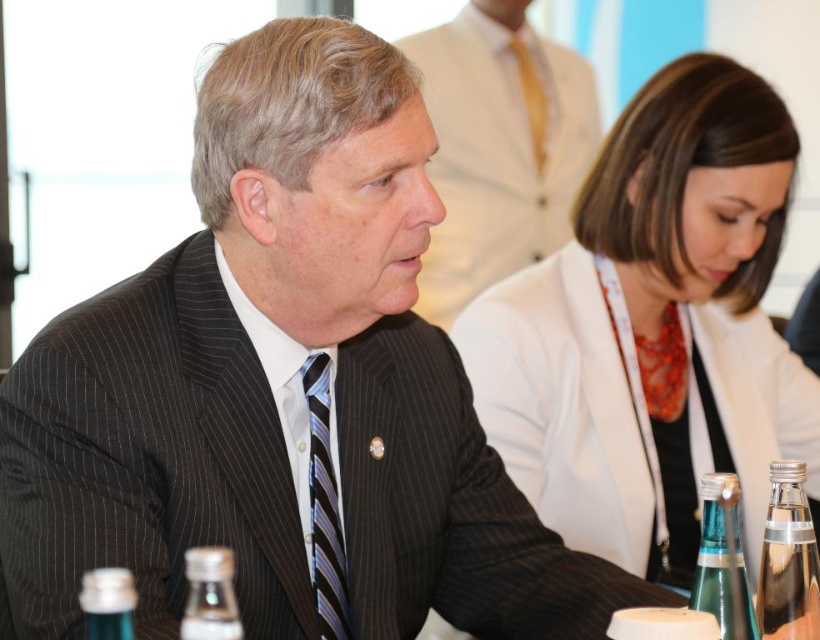
Question: Which of the following is the farthest from the observer?

Choices:
 (A) (597, 452)
 (B) (311, 440)
 (C) (128, 598)
 (D) (740, 556)

Answer: (A)

Question: Does pinstriped suit at center appear on the left side of translucent glass bottle at lower left?

Choices:
 (A) no
 (B) yes

Answer: (A)

Question: Is clear glass bottle at lower right positioned at the back of clear glass bottle at lower center?

Choices:
 (A) no
 (B) yes

Answer: (B)

Question: In this image, where is pinstriped suit at center located relative to striped fabric tie at center?

Choices:
 (A) below
 (B) above

Answer: (B)

Question: Estimate the real-world distances between objects in this image. Which object is farther from the white fabric jacket at center?

Choices:
 (A) clear glass bottle at lower right
 (B) striped fabric tie at center
 (C) clear glass bottle at lower center
 (D) clear glass bottle at lower left

Answer: (D)

Question: Among these objects, which one is farthest from the camera?

Choices:
 (A) satin yellow tie at center
 (B) pinstriped suit at center
 (C) striped fabric tie at center
 (D) translucent glass bottle at lower left

Answer: (A)